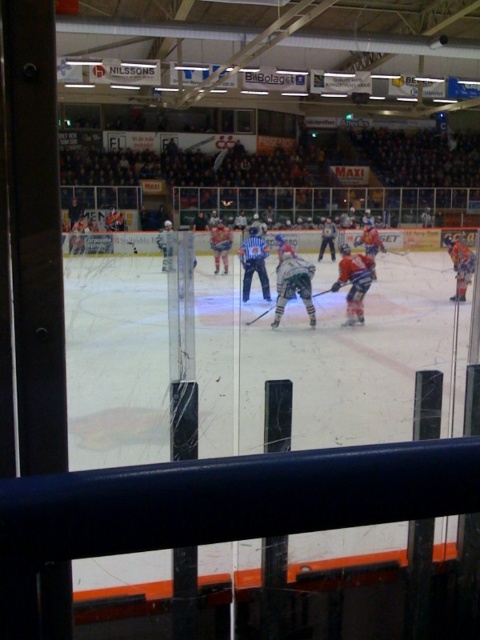
Question: Among these points, which one is farthest from the camera?

Choices:
 (A) (355, 253)
 (B) (227, 243)

Answer: (B)

Question: Does orange jersey at center appear over blue jersey at right?

Choices:
 (A) yes
 (B) no

Answer: (B)

Question: Is orange jersey at center smaller than blue jersey at right?

Choices:
 (A) yes
 (B) no

Answer: (A)

Question: Which object is the closest to the blue jersey at center?

Choices:
 (A) white jersey at center
 (B) orange jersey at center
 (C) shiny silver helmet at center

Answer: (C)

Question: Does orange jersey at center appear over blue jersey at right?

Choices:
 (A) yes
 (B) no

Answer: (B)

Question: Among these points, which one is farthest from the camera?

Choices:
 (A) (466, 282)
 (B) (351, 308)
 (C) (294, 284)
 (D) (241, 246)

Answer: (D)